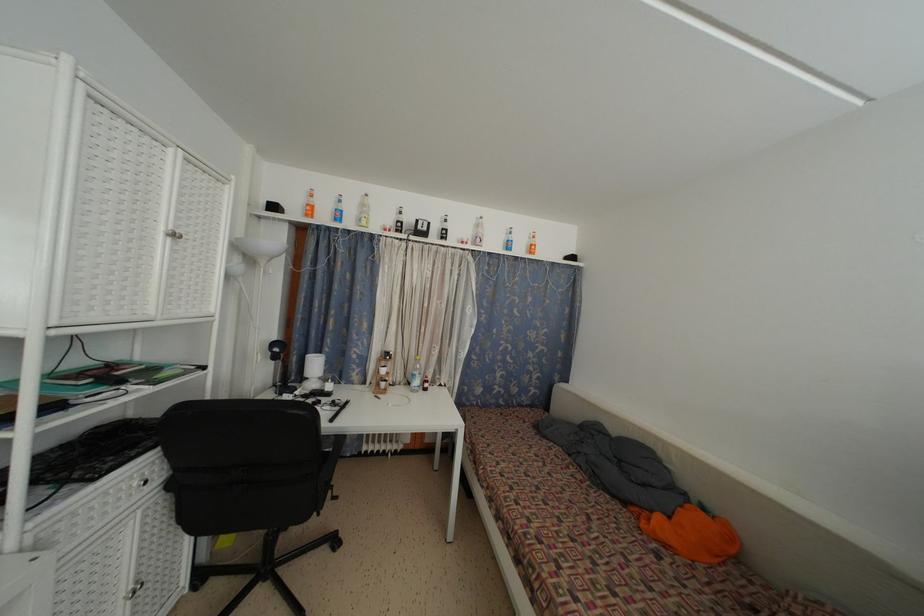
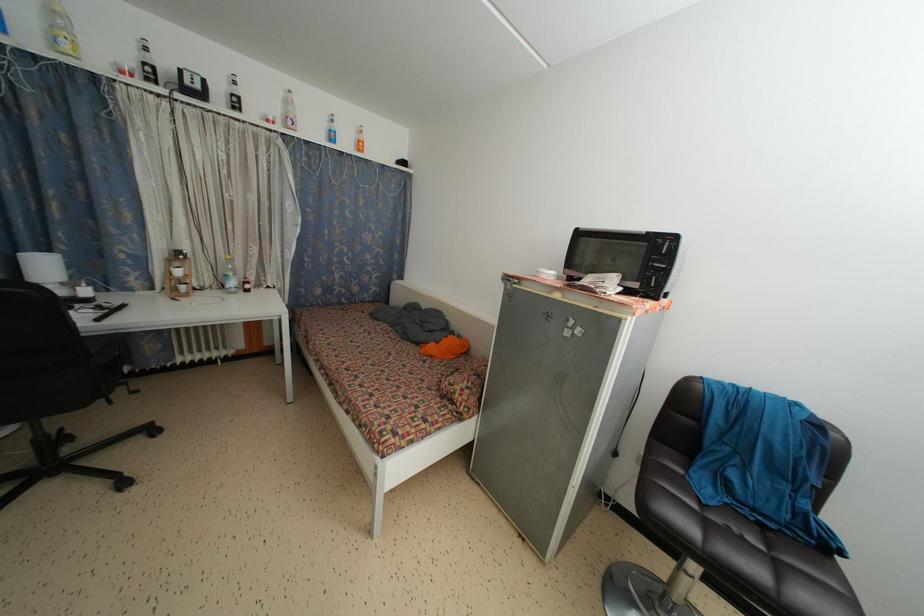
Find the pixel in the second image that matches (323,357) in the first image.

(52, 254)